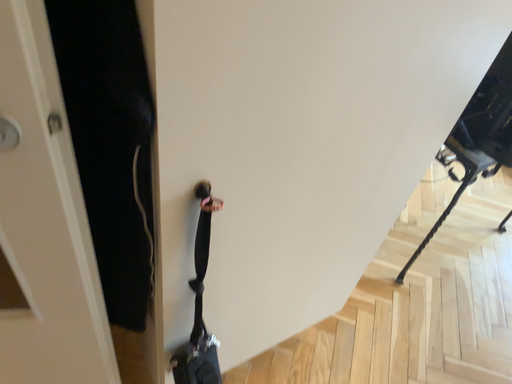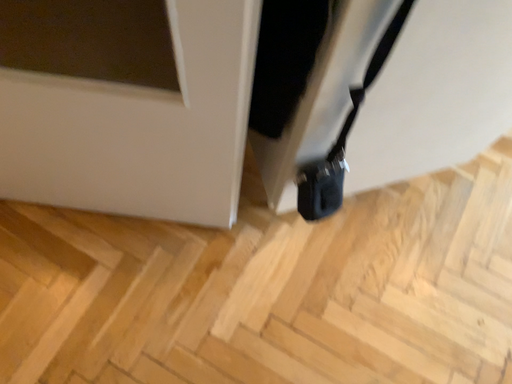
Question: How did the camera likely rotate when shooting the video?

Choices:
 (A) rotated right
 (B) rotated left

Answer: (B)